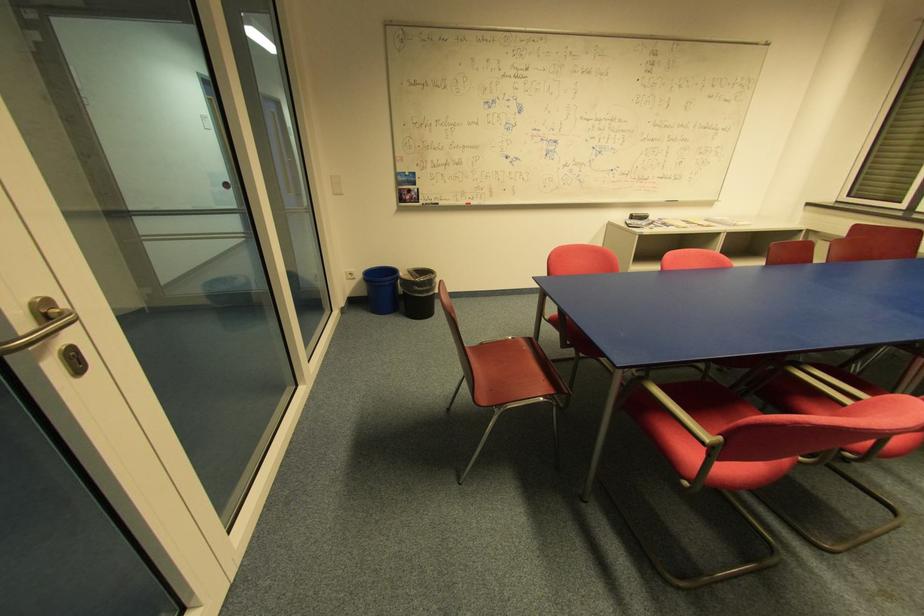
What do you see at coordinates (349, 275) in the screenshot? I see `a white electrical outlet` at bounding box center [349, 275].